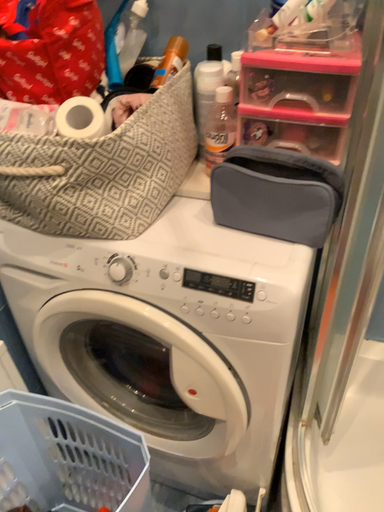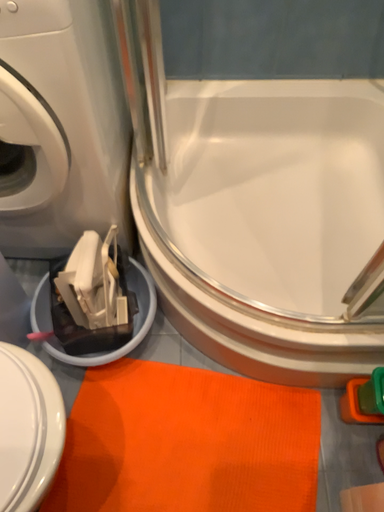
Question: Which way did the camera rotate in the video?

Choices:
 (A) rotated downward
 (B) rotated upward

Answer: (A)